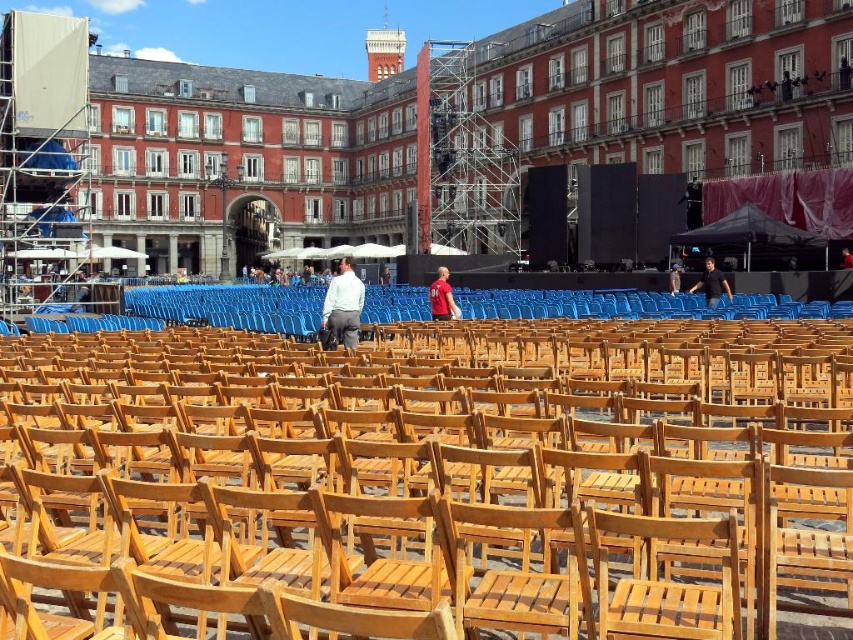
The width and height of the screenshot is (853, 640). Describe the element at coordinates (442, 298) in the screenshot. I see `red shirt at center` at that location.

Does red shirt at center have a greater width compared to brown wooden chair at center?

Indeed, red shirt at center has a greater width compared to brown wooden chair at center.

Does point (450, 308) come farther from viewer compared to point (675, 266)?

No, it is in front of (675, 266).

Where is `red shirt at center`? red shirt at center is located at coordinates [442, 298].

Between red shirt at center and dark blue shirt at center, which one is positioned higher?

red shirt at center

Is point (451, 314) more distant than point (709, 273)?

Yes, point (451, 314) is behind point (709, 273).

Does point (445, 273) lie behind point (703, 289)?

Yes.

Image resolution: width=853 pixels, height=640 pixels. I want to click on red shirt at center, so click(x=442, y=298).

Who is taller, wooden chair at center or dark blue shirt at center?

With more height is wooden chair at center.

Between point (222, 394) and point (712, 288), which one is positioned in front?

Point (222, 394)

At what (x,y) coordinates should I click in order to perform the action: click on wooden chair at center. Please return your answer as a coordinate pair (x, y). The image size is (853, 640). Looking at the image, I should click on [438, 472].